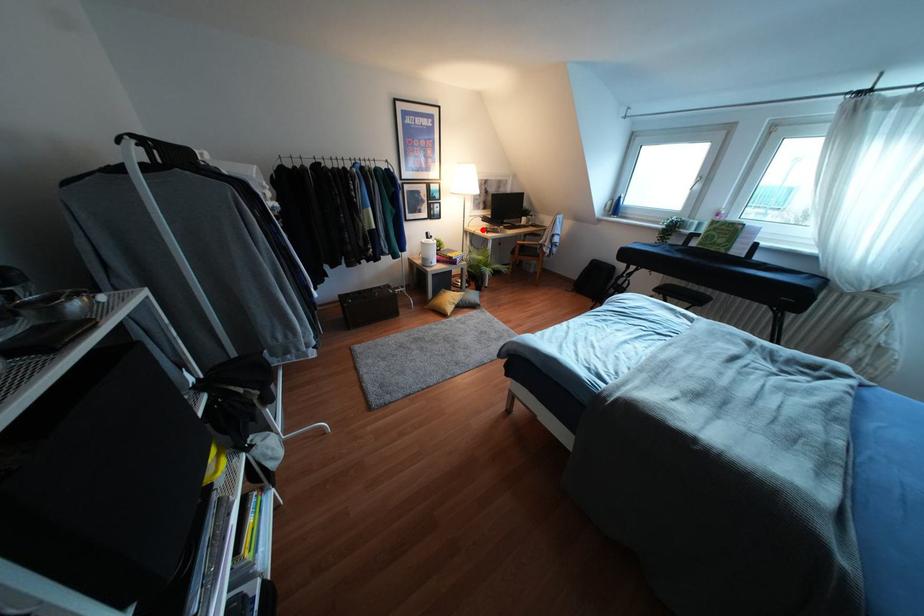
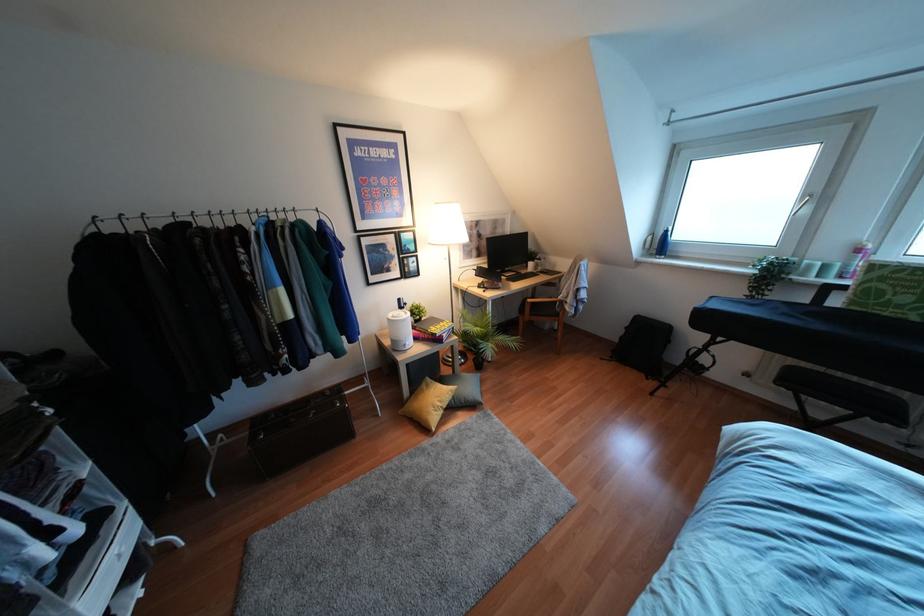
Question: I am providing you with two images of the same scene from different viewpoints. A red point is marked on the first image. Is the red point's position out of view in image 2?

Choices:
 (A) Yes
 (B) No

Answer: (B)